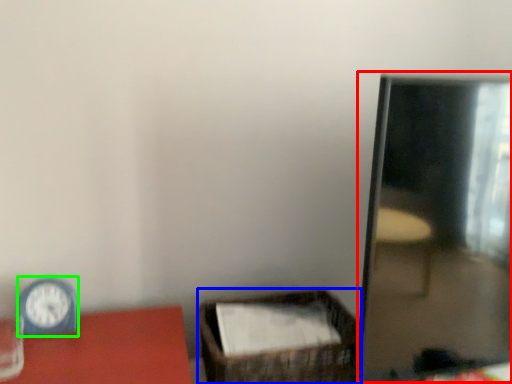
Question: Which object is the closest to the mirror (highlighted by a red box)? Choose among these: basket (highlighted by a blue box) or clock (highlighted by a green box).

Choices:
 (A) basket
 (B) clock

Answer: (A)